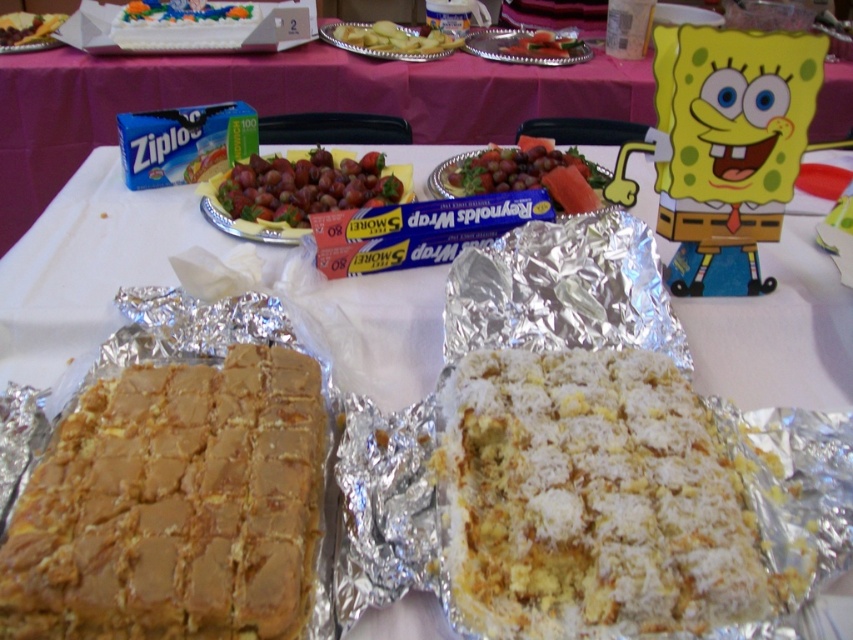
Question: Is silver foil cake at center smaller than smooth green cucumber at center?

Choices:
 (A) yes
 (B) no

Answer: (B)

Question: Where is yellow cake at center located in relation to smooth green cucumber at center in the image?

Choices:
 (A) left
 (B) right

Answer: (A)

Question: Which of the following is the farthest from the observer?

Choices:
 (A) (126, 20)
 (B) (697, 433)

Answer: (A)

Question: Which object is positioned closest to the shiny purple grapes at center?

Choices:
 (A) smooth plastic cake at center
 (B) white crumbly cake at center
 (C) fresh green grapes at center
 (D) yellow cake at center

Answer: (C)

Question: Which is nearer to the yellow cake at center?

Choices:
 (A) shiny purple grapes at center
 (B) fresh green grapes at center
 (C) white crumbly cake at center

Answer: (A)

Question: Can you confirm if golden brown cake at center is positioned to the left of shiny purple grapes at center?

Choices:
 (A) yes
 (B) no

Answer: (B)